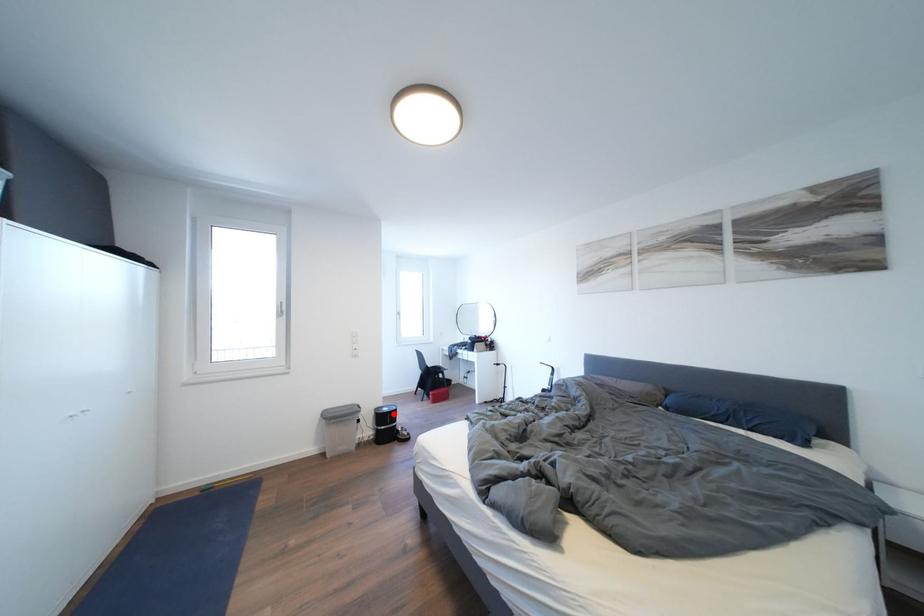
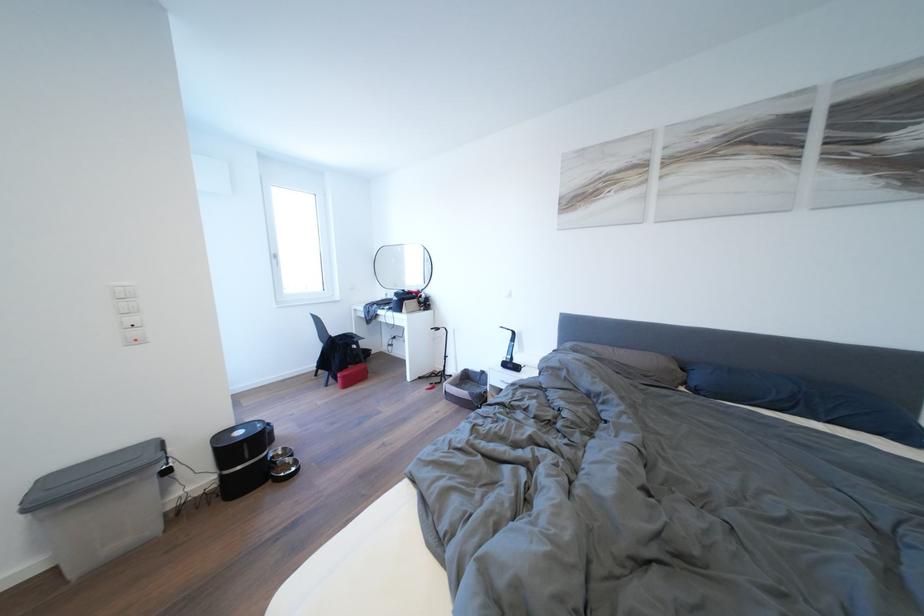
The point at the highlighted location is marked in the first image. Where is the corresponding point in the second image?

(248, 438)